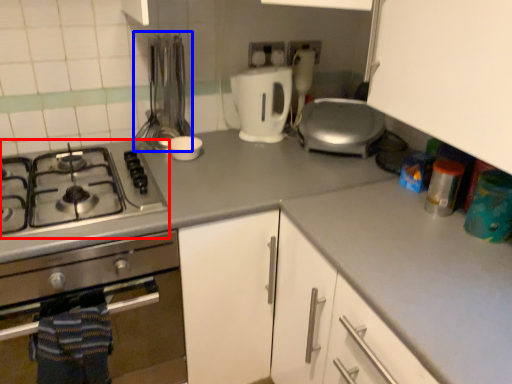
Question: Which object appears farthest to the camera in this image, gas stove (highlighted by a red box) or silverware (highlighted by a blue box)?

Choices:
 (A) gas stove
 (B) silverware

Answer: (B)